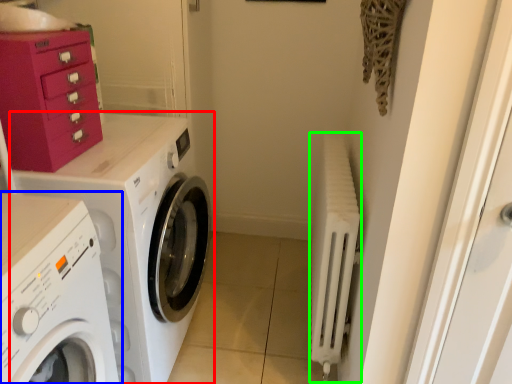
Question: Which object is the closest to the washing machine (highlighted by a red box)? Choose among these: washing machine (highlighted by a blue box) or radiator (highlighted by a green box).

Choices:
 (A) washing machine
 (B) radiator

Answer: (A)